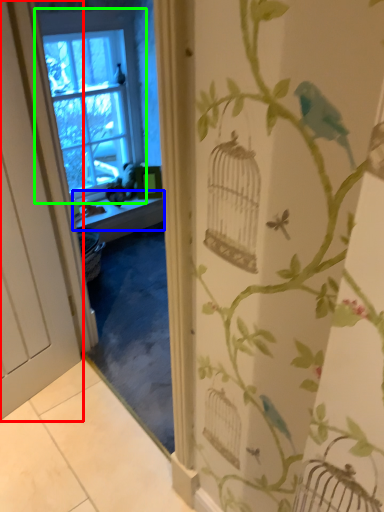
Question: Which is nearer to the door (highlighted by a red box)? window sill (highlighted by a blue box) or window (highlighted by a green box).

Choices:
 (A) window sill
 (B) window

Answer: (A)